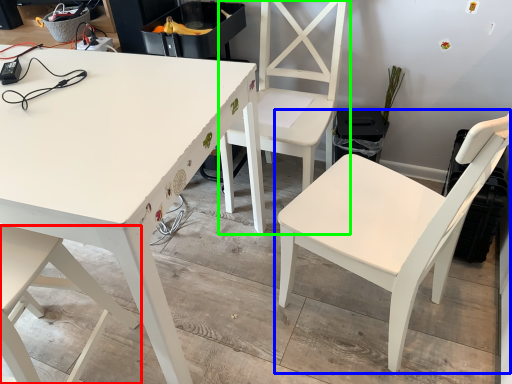
Question: Which object is the farthest from chair (highlighted by a red box)? Choose among these: chair (highlighted by a blue box) or chair (highlighted by a green box).

Choices:
 (A) chair
 (B) chair

Answer: (B)